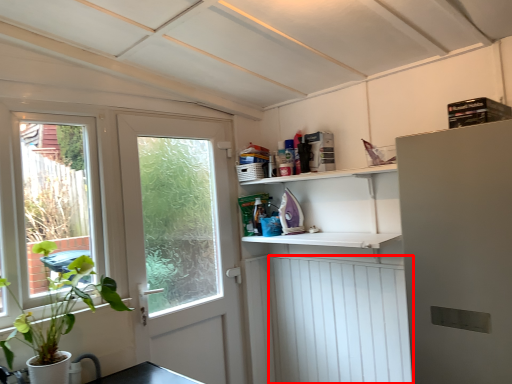
Question: From the image's perspective, considering the relative positions of screen door (annotated by the red box) and door in the image provided, where is screen door (annotated by the red box) located with respect to the staircase?

Choices:
 (A) below
 (B) above

Answer: (A)